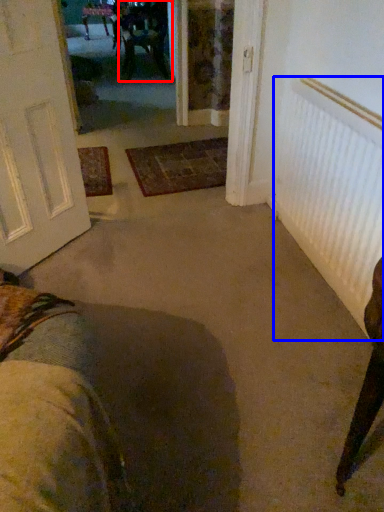
Question: Which object appears farthest to the camera in this image, chair (highlighted by a red box) or radiator (highlighted by a blue box)?

Choices:
 (A) chair
 (B) radiator

Answer: (A)